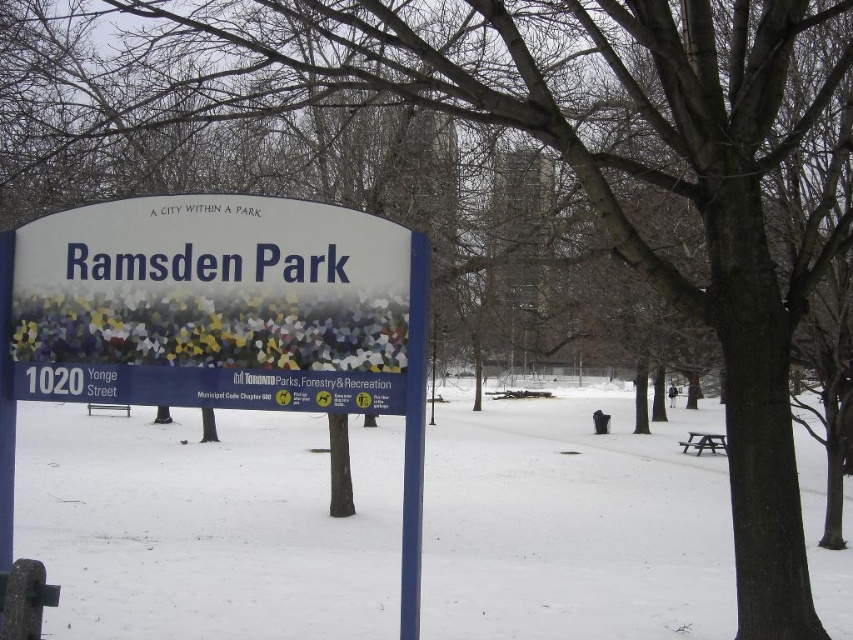
You are standing at the entrance of Ramsden Park and want to locate the blue plastic sign at center. According to the map coordinates, where should you look?

The blue plastic sign at center is located at point [219,321].

You are standing in Ramsden Park and want to take a photo of the blue plastic sign at center while avoiding the white powdery snow at center. Which direction should you move to position yourself so that the snow is no longer in the frame?

Move to the right of the blue plastic sign at center so that the white powdery snow at center, which is to the left of the sign, is out of the frame.